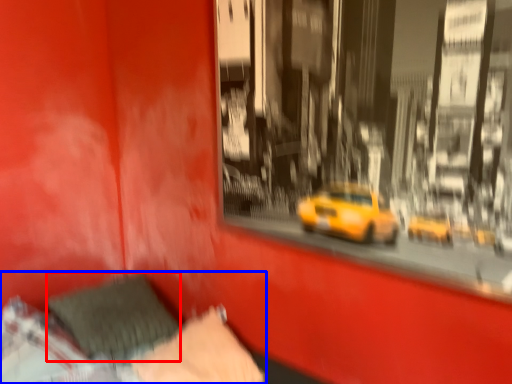
Question: Which object is further to the camera taking this photo, pillow (highlighted by a red box) or bed (highlighted by a blue box)?

Choices:
 (A) pillow
 (B) bed

Answer: (A)